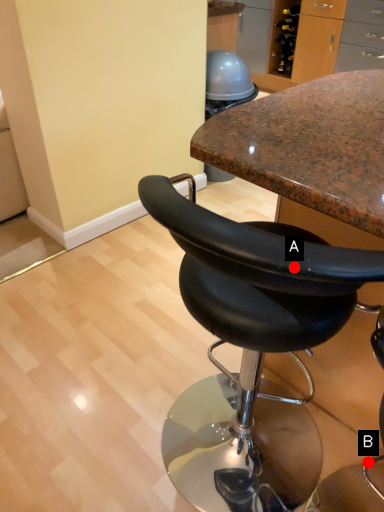
Question: Two points are circled on the image, labeled by A and B beside each circle. Which point is closer to the camera?

Choices:
 (A) A is closer
 (B) B is closer

Answer: (A)